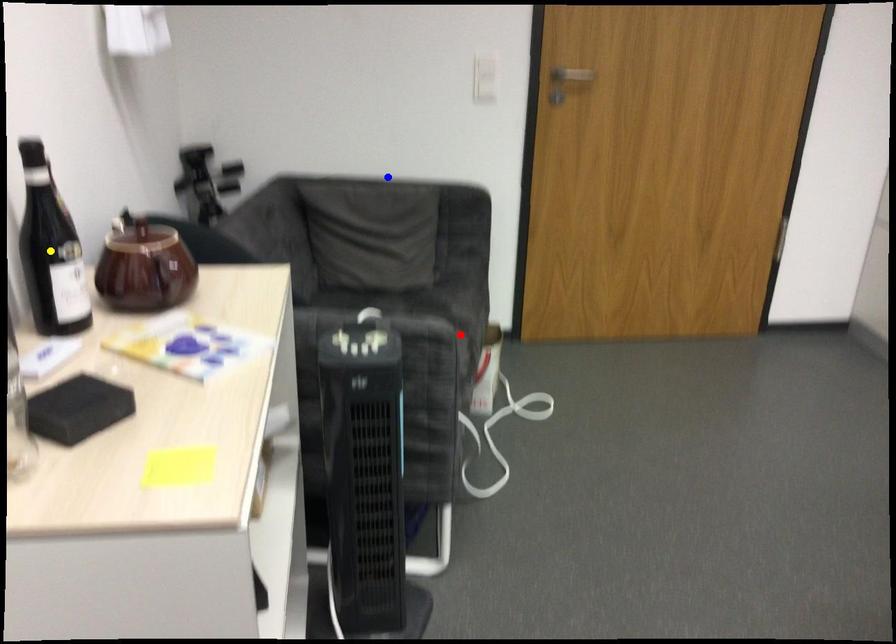
Looking at this image, order these from nearest to farthest:
red point
blue point
yellow point

blue point < red point < yellow point